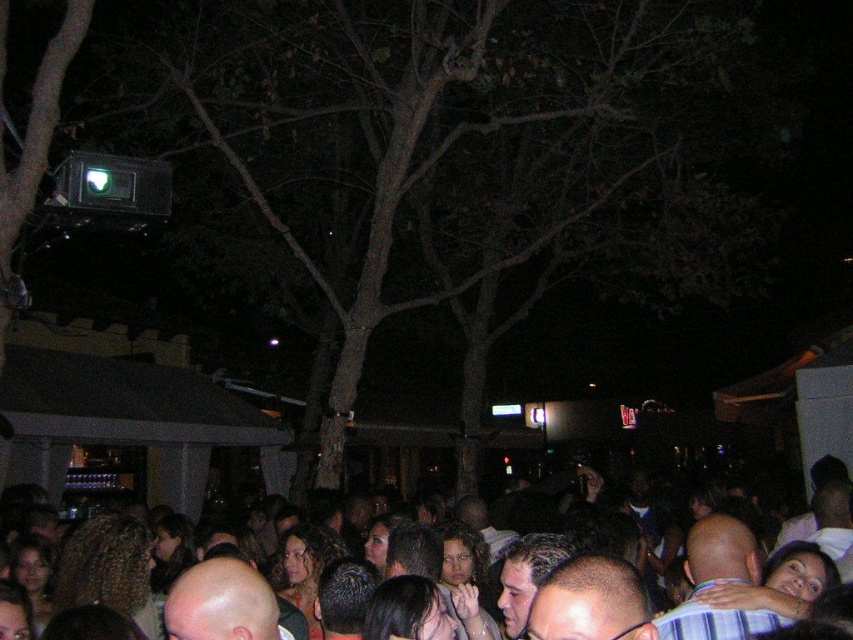
Who is more distant from viewer, [534,602] or [178,630]?

Point [178,630]

I want to click on shiny bald head at center, so click(x=590, y=602).

Does brown bark tree at upper center appear under dark hair crowd at center?

No.

Who is lower down, brown bark tree at upper center or dark hair crowd at center?

dark hair crowd at center

At what (x,y) coordinates should I click in order to perform the action: click on brown bark tree at upper center. Please return your answer as a coordinate pair (x, y). The width and height of the screenshot is (853, 640). Looking at the image, I should click on (427, 134).

Where is `brown bark tree at upper center`? brown bark tree at upper center is located at coordinates (427, 134).

Between point (689, 616) and point (635, 609), which one is positioned behind?

Positioned behind is point (689, 616).

The image size is (853, 640). What do you see at coordinates (718, 582) in the screenshot?
I see `striped shirt at center` at bounding box center [718, 582].

Find the location of a particular element. The height and width of the screenshot is (640, 853). striped shirt at center is located at coordinates (718, 582).